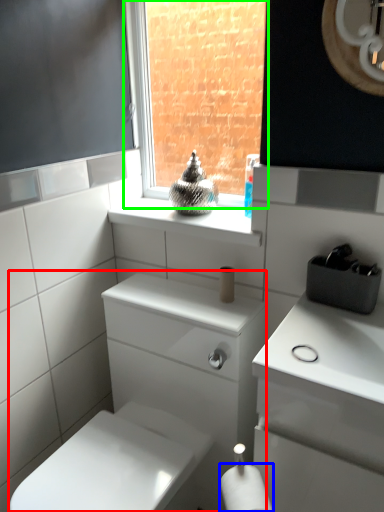
Question: Which object is the closest to the porcelain (highlighted by a red box)? Choose among these: toilet paper (highlighted by a blue box) or window (highlighted by a green box).

Choices:
 (A) toilet paper
 (B) window

Answer: (A)